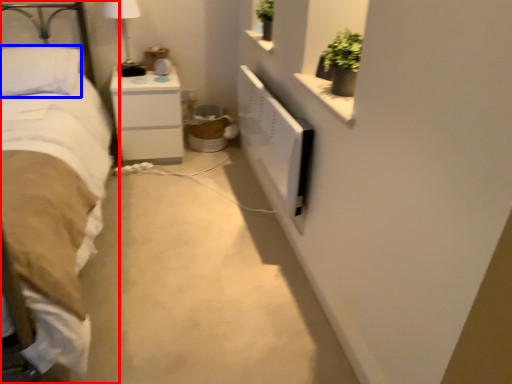
Question: Which point is closer to the camera, bed (highlighted by a red box) or pillow (highlighted by a blue box)?

Choices:
 (A) bed
 (B) pillow

Answer: (A)